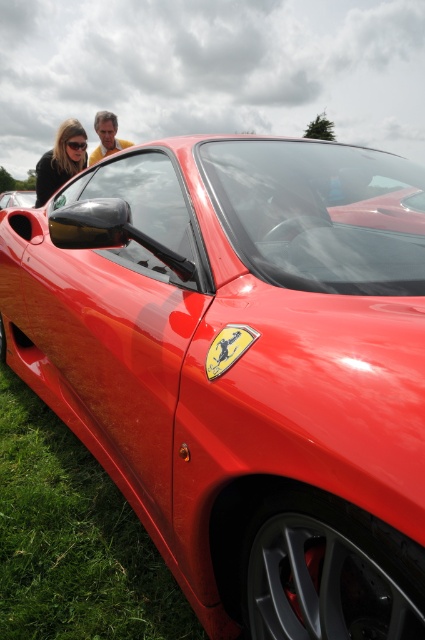
Is green grass at lower left bigger than matte black hair at upper left?

Yes, green grass at lower left is bigger than matte black hair at upper left.

Does green grass at lower left have a lesser height compared to matte black hair at upper left?

Yes.

Who is more distant from viewer, (45,554) or (105,148)?

The point (105,148) is more distant.

Where is `green grass at lower left`? The height and width of the screenshot is (640, 425). green grass at lower left is located at coordinates (73, 540).

Who is more forward, (73,129) or (130,141)?

Point (73,129) is more forward.

Which is more to the left, matte black sunglasses at upper left or matte black hair at upper left?

Positioned to the left is matte black sunglasses at upper left.

Identify the location of matte black sunglasses at upper left. Image resolution: width=425 pixels, height=640 pixels. (61, 160).

Is the position of green grass at lower left less distant than that of matte black sunglasses at upper left?

Yes, green grass at lower left is in front of matte black sunglasses at upper left.

Does point (104, 548) lie in front of point (76, 157)?

Yes.

Locate an element on the screen. The image size is (425, 640). green grass at lower left is located at coordinates (x=73, y=540).

Locate an element on the screen. Image resolution: width=425 pixels, height=640 pixels. green grass at lower left is located at coordinates (73, 540).